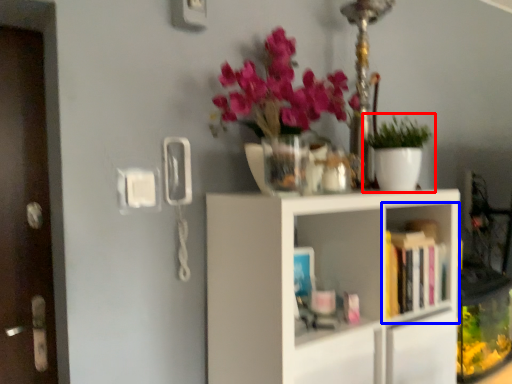
Question: Which object appears closest to the camera in this image, houseplant (highlighted by a red box) or shelf (highlighted by a blue box)?

Choices:
 (A) houseplant
 (B) shelf

Answer: (B)